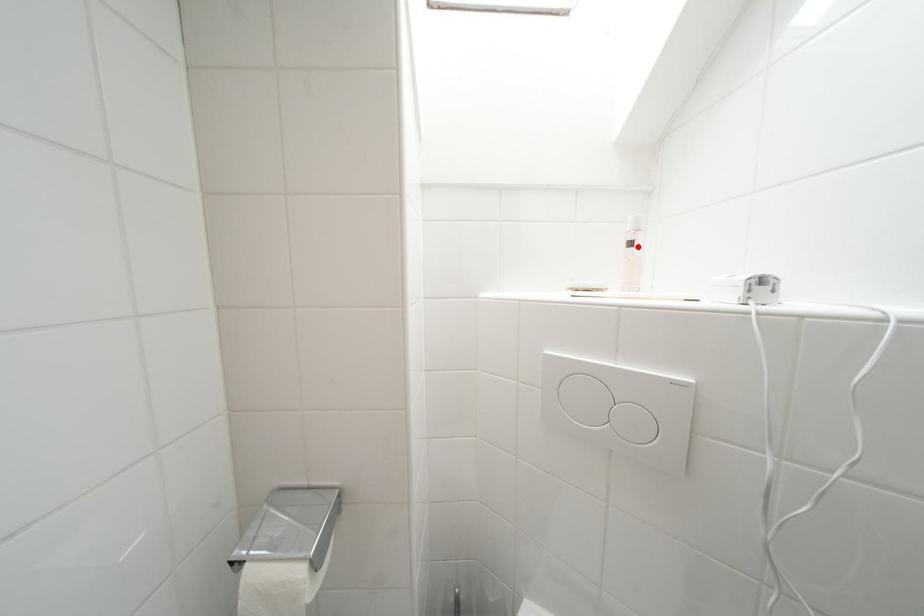
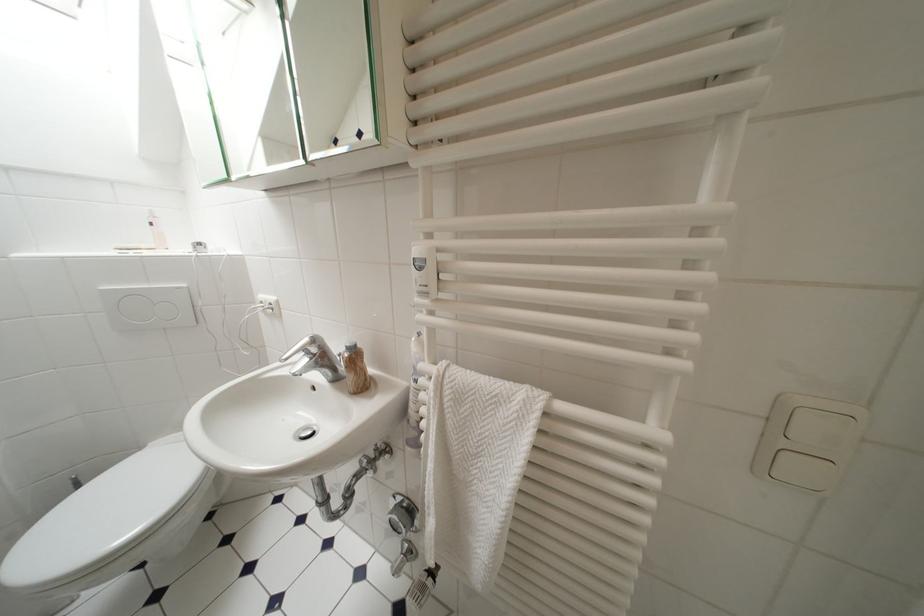
Locate, in the second image, the point that corresponds to the highlighted location in the first image.

(159, 227)